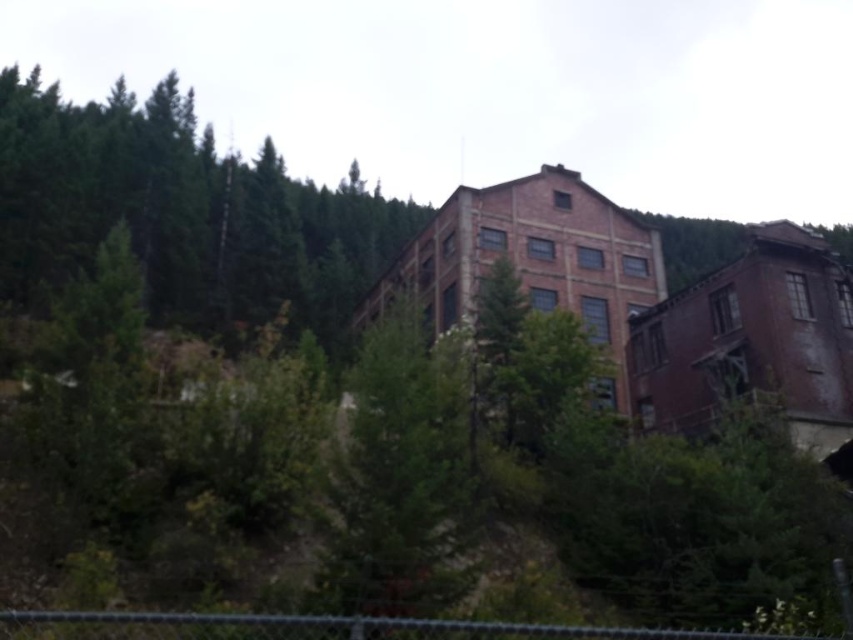
You are a bird looking for a nesting spot. You see the green matte tree at upper left and the green leafy tree at center. Which tree has a wider canopy for nesting?

The green matte tree at upper left might be wider than the green leafy tree at center, so it could provide a wider canopy for nesting.

You are standing in front of the old red brick building surrounded by tall coniferous trees. You notice two points marked in the scene at coordinates point (271, 312) and point (436, 372). Which point is closer to you?

Point (271, 312) is further to the camera than point (436, 372), so the point closer to you is point (436, 372).

You are a bird looking for a nesting spot. You see the green matte tree at upper left and the green leafy tree at center. Which tree would you choose if you prefer nesting in taller trees?

The green matte tree at upper left is much taller than the green leafy tree at center, so you should choose the green matte tree at upper left for nesting.